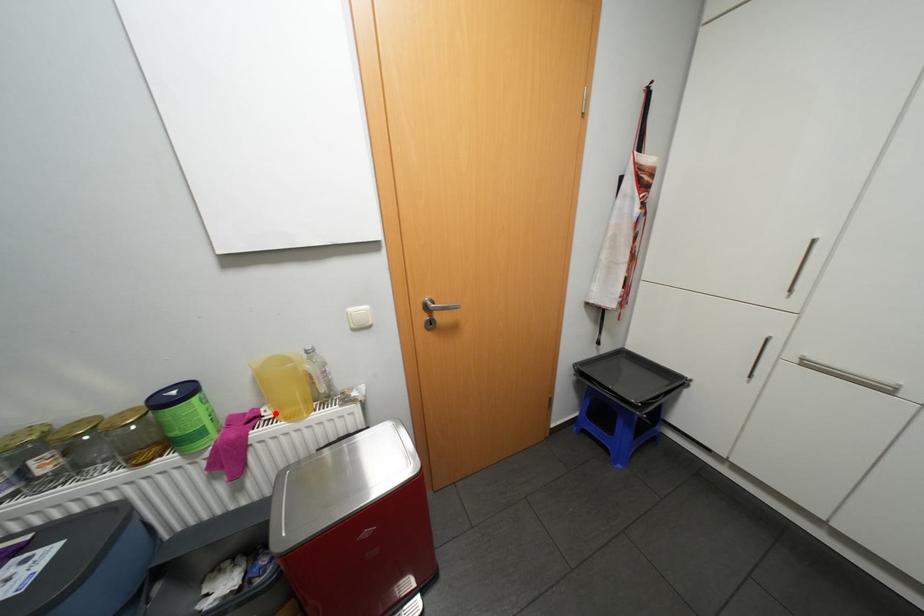
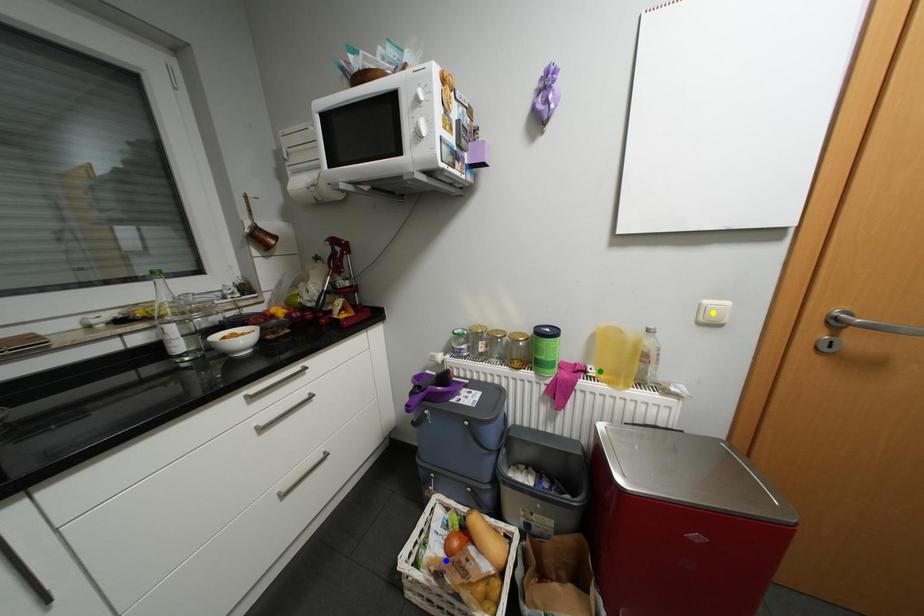
Question: I am providing you with two images of the same scene from different viewpoints. A red point is marked on the first image. You are given multiple points on the second image. Can you choose the point in image 2 that corresponds to the point in image 1?

Choices:
 (A) yellow point
 (B) green point
 (C) blue point

Answer: (B)